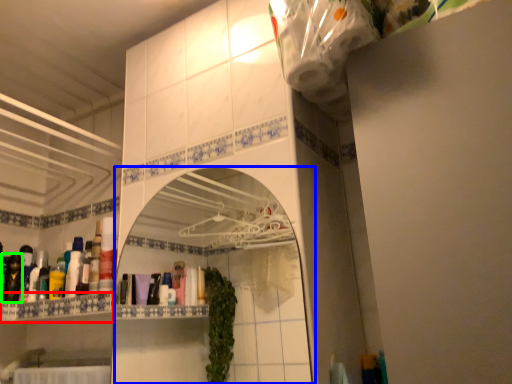
Question: Which is nearer to the cabinet (highlighted by a red box)? mirror (highlighted by a blue box) or toiletry (highlighted by a green box).

Choices:
 (A) mirror
 (B) toiletry

Answer: (B)